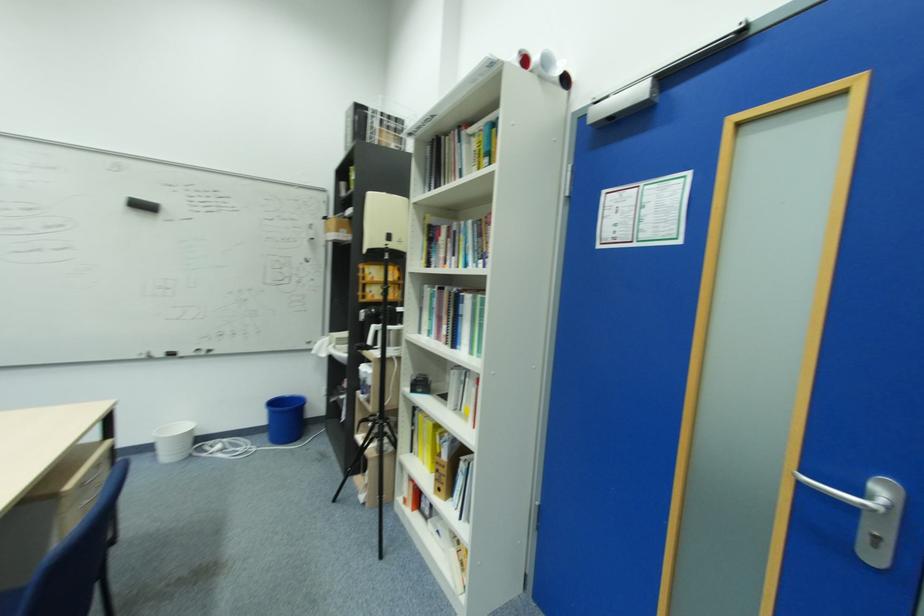
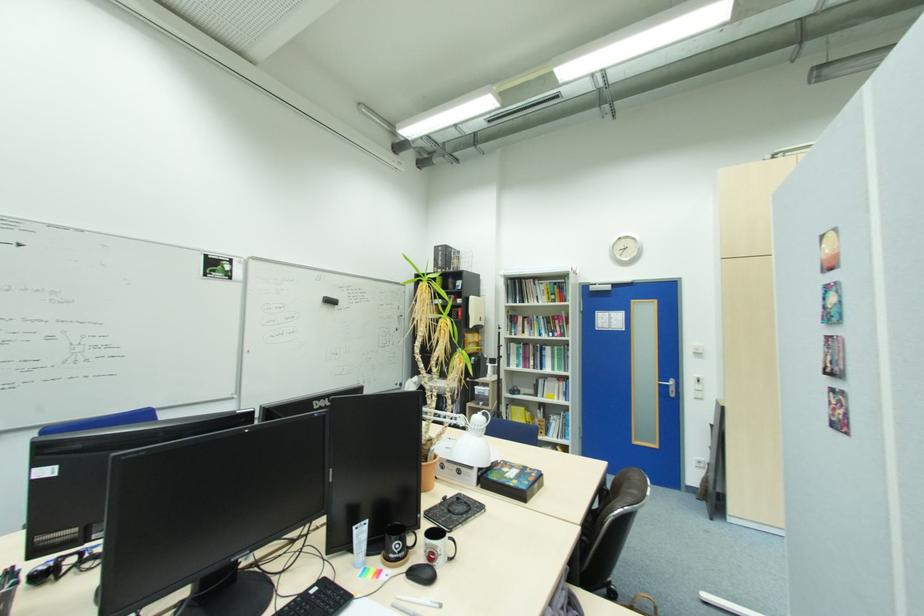
Locate, in the second image, the point that corresponds to (x=467, y=134) in the first image.

(541, 283)